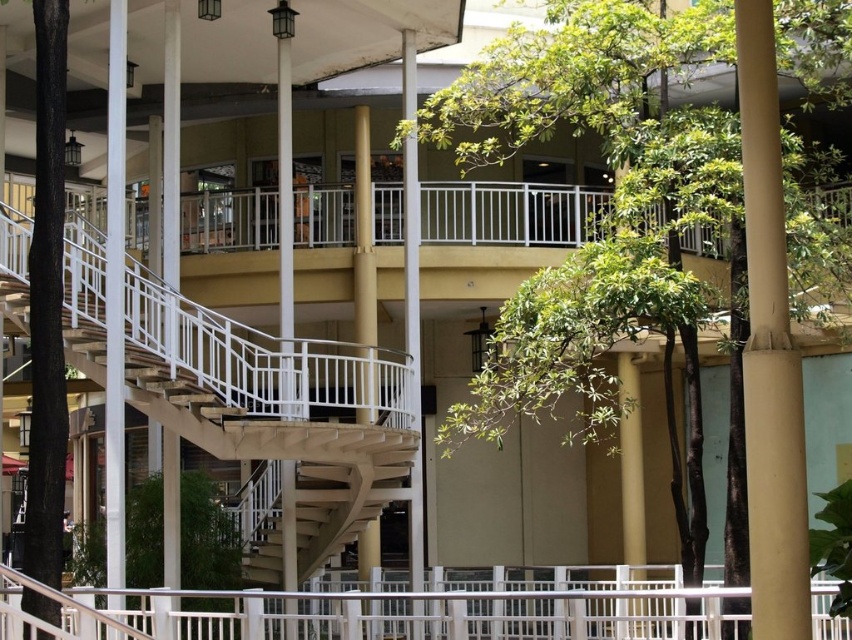
Does green leafy tree at center appear on the left side of white metal railing at center?

In fact, green leafy tree at center is to the right of white metal railing at center.

Can you confirm if green leafy tree at center is shorter than white metal railing at center?

No.

Is point (779, 538) positioned after point (237, 620)?

No, (779, 538) is in front of (237, 620).

Find the location of a particular element. green leafy tree at center is located at coordinates (613, 195).

Can you confirm if green leafy tree at center is smaller than tan smooth pole at right?

Actually, green leafy tree at center might be larger than tan smooth pole at right.

Does green leafy tree at center appear over tan smooth pole at right?

Yes.

At what (x,y) coordinates should I click in order to perform the action: click on green leafy tree at center. Please return your answer as a coordinate pair (x, y). This screenshot has width=852, height=640. Looking at the image, I should click on (613, 195).

Locate an element on the screen. green leafy tree at center is located at coordinates (613, 195).

Is white metal railing at center to the right of tan smooth pole at right from the viewer's perspective?

Incorrect, white metal railing at center is not on the right side of tan smooth pole at right.

Does white metal railing at center appear on the left side of tan smooth pole at right?

Indeed, white metal railing at center is positioned on the left side of tan smooth pole at right.

Image resolution: width=852 pixels, height=640 pixels. What are the coordinates of `white metal railing at center` in the screenshot? It's located at (369, 612).

You are a GUI agent. You are given a task and a screenshot of the screen. Output one action in this format:
    pyautogui.click(x=<x>, y=<y>)
    Task: Click on the white metal railing at center
    This screenshot has height=640, width=852.
    Given the screenshot: What is the action you would take?
    pyautogui.click(x=369, y=612)